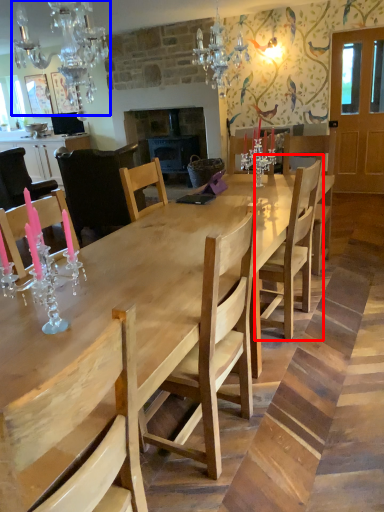
Question: Which object is closer to the camera taking this photo, chair (highlighted by a red box) or light fixture (highlighted by a blue box)?

Choices:
 (A) chair
 (B) light fixture

Answer: (B)